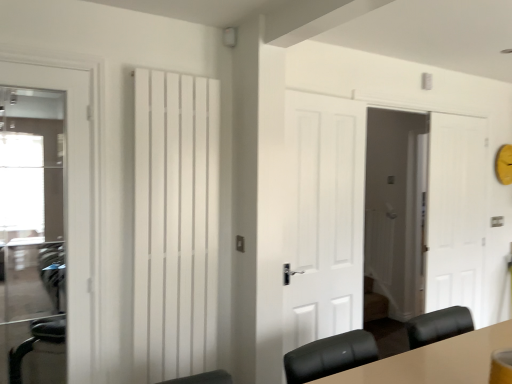
This screenshot has height=384, width=512. What are the coordinates of `free location above white matte radiator at center (from a real-world perspective)` in the screenshot? It's located at (177, 71).